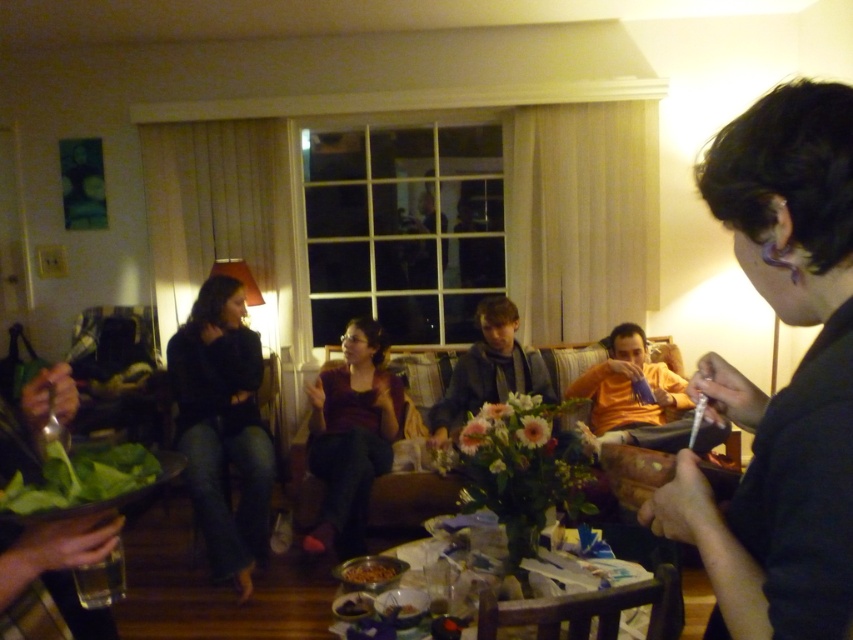
You are organizing a closet and need to place the black fabric shirt at right and the matte purple sweater at center. Given their sizes, which item should you place first in the drawer to ensure both fit?

The black fabric shirt at right is smaller than the matte purple sweater at center, so you should place the matte purple sweater at center first to make space for the smaller shirt.

You are a guest at this gathering and want to place a small item on the nearest available surface. The black matte jeans at left and the brown matte bowl at lower center are in your line of sight. Which one is closer to you and can you place the item there?

The brown matte bowl at lower center is closer to you than the black matte jeans at left. However, since the bowl is likely holding food or items, placing an object there might not be appropriate. The black matte jeans at left is above the bowl, so it might be a better option if it is a flat surface.